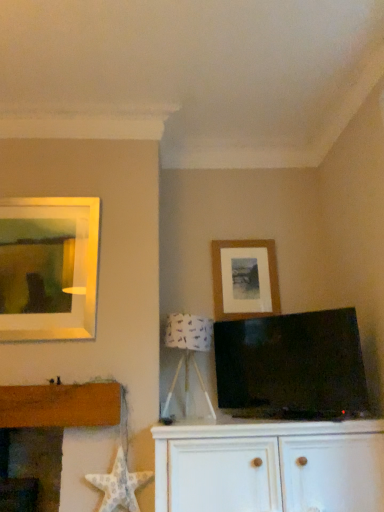
Question: Is the position of wooden picture frame at upper right more distant than that of white wood cabinet at center?

Choices:
 (A) no
 (B) yes

Answer: (B)

Question: Does wooden picture frame at upper right have a lesser width compared to white wood cabinet at center?

Choices:
 (A) no
 (B) yes

Answer: (B)

Question: From a real-world perspective, does wooden picture frame at upper right stand above white wood cabinet at center?

Choices:
 (A) yes
 (B) no

Answer: (A)

Question: Can you confirm if wooden picture frame at upper right is shorter than white wood cabinet at center?

Choices:
 (A) yes
 (B) no

Answer: (B)

Question: Can you confirm if wooden picture frame at upper right is wider than white wood cabinet at center?

Choices:
 (A) yes
 (B) no

Answer: (B)

Question: From a real-world perspective, is white fabric lampshade at center above or below white textured starfish at lower left?

Choices:
 (A) below
 (B) above

Answer: (B)

Question: Is point (203, 347) closer or farther from the camera than point (112, 480)?

Choices:
 (A) closer
 (B) farther

Answer: (B)

Question: Would you say white fabric lampshade at center is to the left or to the right of white textured starfish at lower left in the picture?

Choices:
 (A) right
 (B) left

Answer: (A)

Question: Based on their sizes in the image, would you say white fabric lampshade at center is bigger or smaller than white textured starfish at lower left?

Choices:
 (A) small
 (B) big

Answer: (B)

Question: Considering the positions of matte black tv at center and white fabric lampshade at center in the image, is matte black tv at center taller or shorter than white fabric lampshade at center?

Choices:
 (A) tall
 (B) short

Answer: (A)

Question: Would you say matte black tv at center is to the left or to the right of white fabric lampshade at center in the picture?

Choices:
 (A) left
 (B) right

Answer: (B)

Question: Is point (238, 357) closer or farther from the camera than point (196, 370)?

Choices:
 (A) closer
 (B) farther

Answer: (A)

Question: From the image's perspective, relative to white fabric lampshade at center, is matte black tv at center above or below?

Choices:
 (A) below
 (B) above

Answer: (B)

Question: Is white wood cabinet at center in front of or behind matte black tv at center in the image?

Choices:
 (A) front
 (B) behind

Answer: (A)

Question: In terms of width, does white wood cabinet at center look wider or thinner when compared to matte black tv at center?

Choices:
 (A) thin
 (B) wide

Answer: (B)